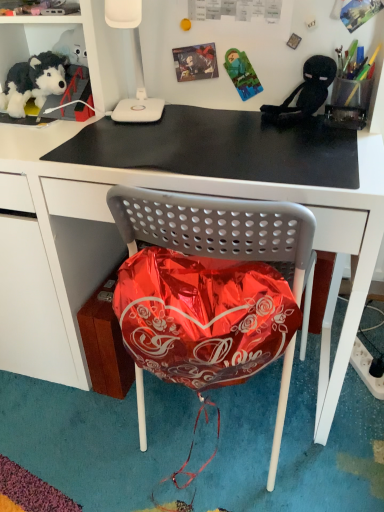
Question: From the image's perspective, does white plastic lamp at upper center appear lower than soft plush toy at upper left?

Choices:
 (A) yes
 (B) no

Answer: (B)

Question: Is white plastic lamp at upper center smaller than soft plush toy at upper left?

Choices:
 (A) no
 (B) yes

Answer: (A)

Question: Is white plastic lamp at upper center far away from soft plush toy at upper left?

Choices:
 (A) yes
 (B) no

Answer: (B)

Question: Does white plastic lamp at upper center come behind soft plush toy at upper left?

Choices:
 (A) yes
 (B) no

Answer: (B)

Question: Can you see white plastic lamp at upper center touching soft plush toy at upper left?

Choices:
 (A) no
 (B) yes

Answer: (A)

Question: Considering the positions of point (321, 54) and point (18, 110), is point (321, 54) closer or farther from the camera than point (18, 110)?

Choices:
 (A) closer
 (B) farther

Answer: (A)

Question: Considering the positions of black plush toy at upper right and soft plush toy at upper left in the image, is black plush toy at upper right wider or thinner than soft plush toy at upper left?

Choices:
 (A) wide
 (B) thin

Answer: (A)

Question: From their relative heights in the image, would you say black plush toy at upper right is taller or shorter than soft plush toy at upper left?

Choices:
 (A) short
 (B) tall

Answer: (B)

Question: In the image, is black plush toy at upper right positioned in front of or behind soft plush toy at upper left?

Choices:
 (A) behind
 (B) front

Answer: (B)

Question: Considering the positions of point (44, 82) and point (147, 99), is point (44, 82) closer or farther from the camera than point (147, 99)?

Choices:
 (A) closer
 (B) farther

Answer: (A)

Question: From a real-world perspective, is soft plush toy at upper left positioned above or below white plastic lamp at upper center?

Choices:
 (A) below
 (B) above

Answer: (A)

Question: Is soft plush toy at upper left to the left or to the right of white plastic lamp at upper center in the image?

Choices:
 (A) right
 (B) left

Answer: (B)

Question: Do you think soft plush toy at upper left is within white plastic lamp at upper center, or outside of it?

Choices:
 (A) outside
 (B) inside

Answer: (A)

Question: From the image's perspective, is black matte mousepad at upper center located above or below white plastic lamp at upper center?

Choices:
 (A) below
 (B) above

Answer: (A)

Question: Considering the positions of black matte mousepad at upper center and white plastic lamp at upper center in the image, is black matte mousepad at upper center wider or thinner than white plastic lamp at upper center?

Choices:
 (A) thin
 (B) wide

Answer: (B)